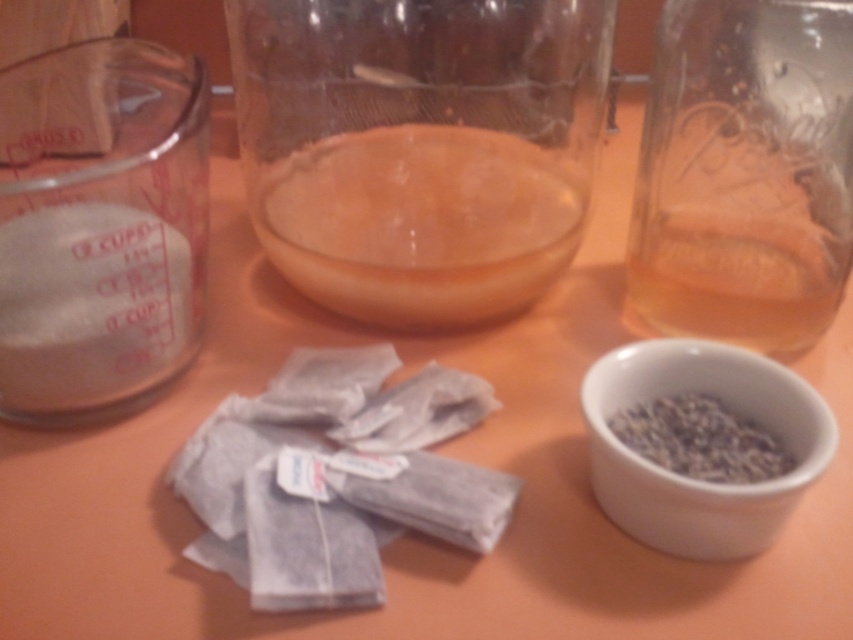
Can you confirm if transparent glass jar at upper right is thinner than dark gray granular at lower right?

Incorrect, transparent glass jar at upper right's width is not less than dark gray granular at lower right's.

Describe the element at coordinates (746, 172) in the screenshot. This screenshot has height=640, width=853. I see `transparent glass jar at upper right` at that location.

Image resolution: width=853 pixels, height=640 pixels. Find the location of `transparent glass jar at upper right`. transparent glass jar at upper right is located at coordinates (746, 172).

Who is shorter, transparent glass jar at center or dark gray granular at lower right?

Standing shorter between the two is dark gray granular at lower right.

Can you confirm if transparent glass jar at center is positioned to the right of dark gray granular at lower right?

No, transparent glass jar at center is not to the right of dark gray granular at lower right.

Describe the element at coordinates (419, 147) in the screenshot. I see `transparent glass jar at center` at that location.

At what (x,y) coordinates should I click in order to perform the action: click on transparent glass jar at center. Please return your answer as a coordinate pair (x, y). The image size is (853, 640). Looking at the image, I should click on (419, 147).

Does white ceramic bowl at lower right have a lesser width compared to dark gray granular at lower right?

In fact, white ceramic bowl at lower right might be wider than dark gray granular at lower right.

Between white ceramic bowl at lower right and dark gray granular at lower right, which one appears on the right side from the viewer's perspective?

dark gray granular at lower right is more to the right.

At what (x,y) coordinates should I click in order to perform the action: click on white ceramic bowl at lower right. Please return your answer as a coordinate pair (x, y). The height and width of the screenshot is (640, 853). Looking at the image, I should click on (699, 481).